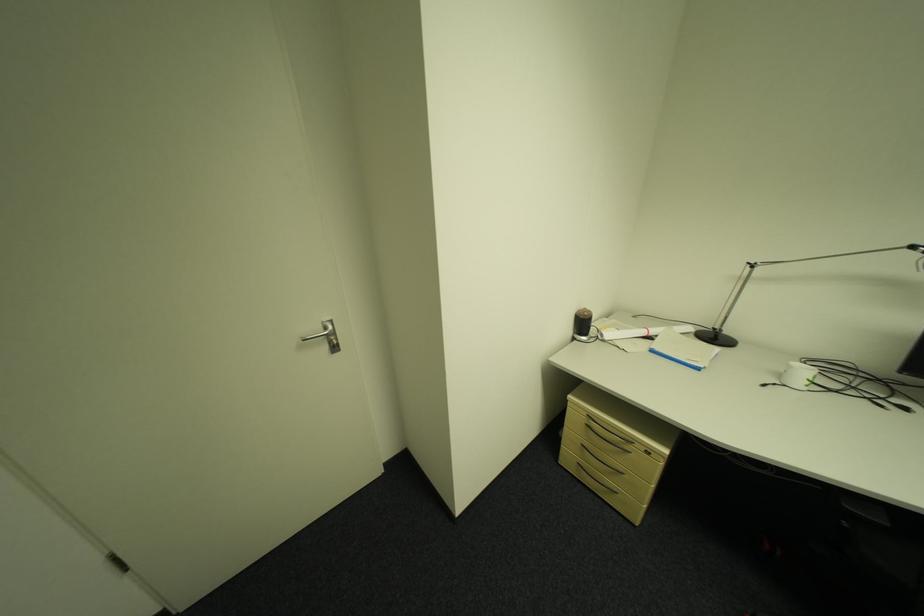
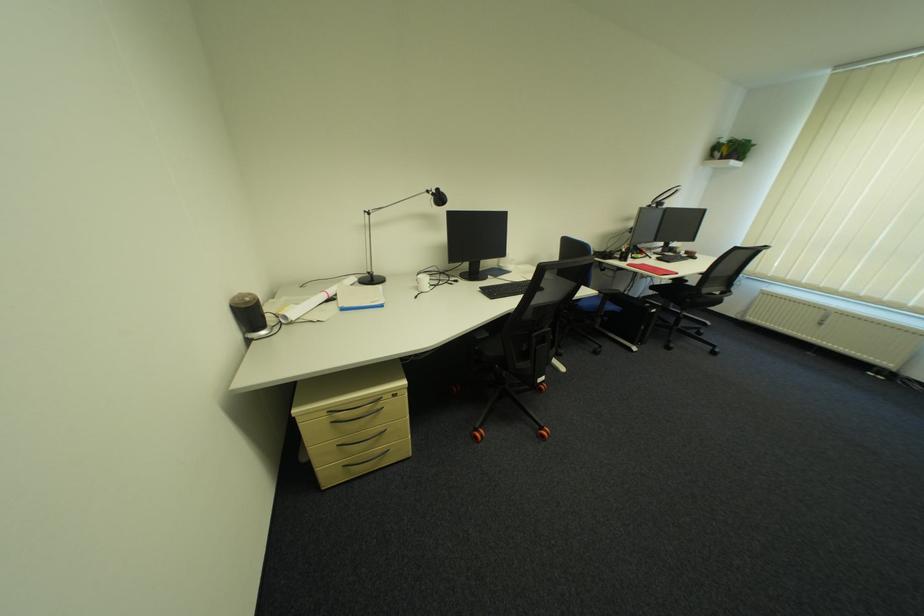
In the second image, find the point that corresponds to [896,525] in the first image.

(497, 334)